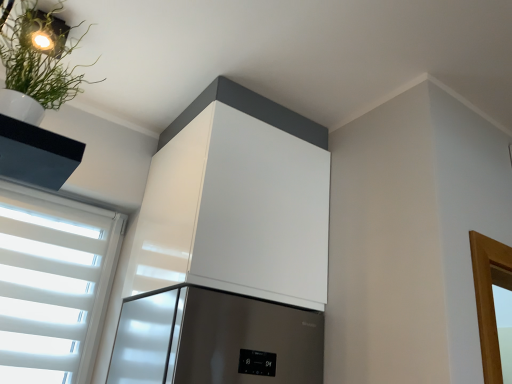
Question: Is white glossy cabinet at upper center spatially inside green matte plant at upper left, or outside of it?

Choices:
 (A) outside
 (B) inside

Answer: (A)

Question: Considering the positions of white glossy cabinet at upper center and green matte plant at upper left in the image, is white glossy cabinet at upper center taller or shorter than green matte plant at upper left?

Choices:
 (A) short
 (B) tall

Answer: (B)

Question: Is point (326, 278) positioned closer to the camera than point (8, 94)?

Choices:
 (A) farther
 (B) closer

Answer: (A)

Question: In terms of size, does green matte plant at upper left appear bigger or smaller than white glossy cabinet at upper center?

Choices:
 (A) big
 (B) small

Answer: (B)

Question: Choose the correct answer: Is green matte plant at upper left inside white glossy cabinet at upper center or outside it?

Choices:
 (A) outside
 (B) inside

Answer: (A)

Question: Is green matte plant at upper left to the left or to the right of white glossy cabinet at upper center in the image?

Choices:
 (A) left
 (B) right

Answer: (A)

Question: Relative to white glossy cabinet at upper center, is green matte plant at upper left in front or behind?

Choices:
 (A) front
 (B) behind

Answer: (A)